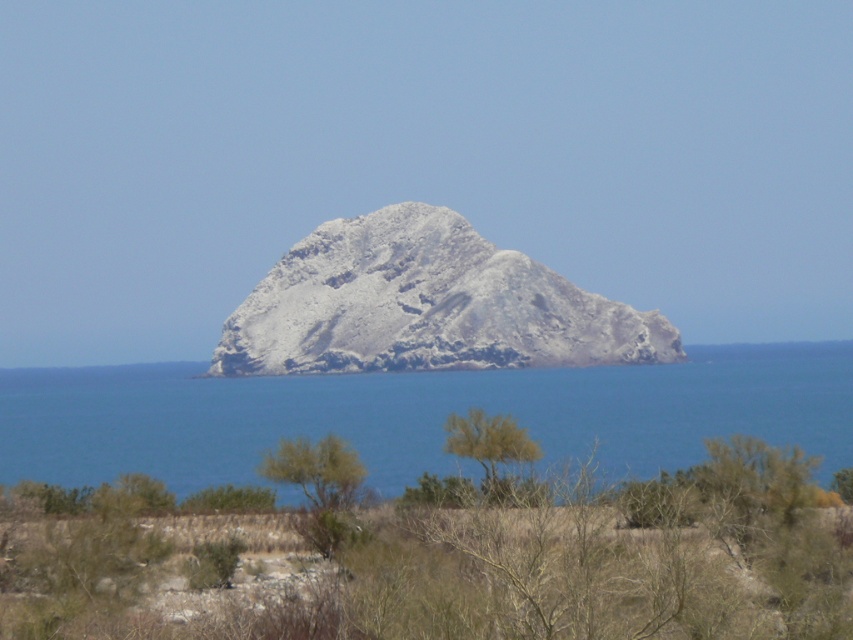
Does blue water at center appear under green leafy tree at center?

Correct, blue water at center is located below green leafy tree at center.

Does blue water at center appear on the left side of green leafy tree at center?

No, blue water at center is not to the left of green leafy tree at center.

Between point (256, 474) and point (514, 451), which one is positioned behind?

The point (256, 474) is more distant.

I want to click on blue water at center, so click(x=421, y=416).

Is point (715, 406) in front of point (287, 454)?

That is False.

Between blue water at center and green leafy shrub at center, which one appears on the right side from the viewer's perspective?

Positioned to the right is blue water at center.

Who is more distant from viewer, (664, 449) or (318, 488)?

The point (664, 449) is more distant.

Identify the location of blue water at center. The height and width of the screenshot is (640, 853). (421, 416).

In the scene shown: Measure the distance between point [274,353] and camera.

1718.32 feet

Is point (465, 369) more distant than point (311, 509)?

Yes, point (465, 369) is behind point (311, 509).

Between point (248, 344) and point (320, 452), which one is positioned behind?

Point (248, 344)

The width and height of the screenshot is (853, 640). In order to click on gray rocky mountain at center in this screenshot , I will do `click(425, 305)`.